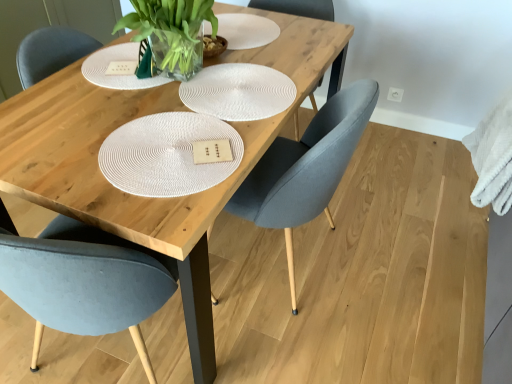
You are a GUI agent. You are given a task and a screenshot of the screen. Output one action in this format:
    pyautogui.click(x=<x>, y=<y>)
    Task: Click on the vacant space to the right of matte gray chair at center, which is counted as the 1th chair, starting from the right
    
    Given the screenshot: What is the action you would take?
    pyautogui.click(x=398, y=267)